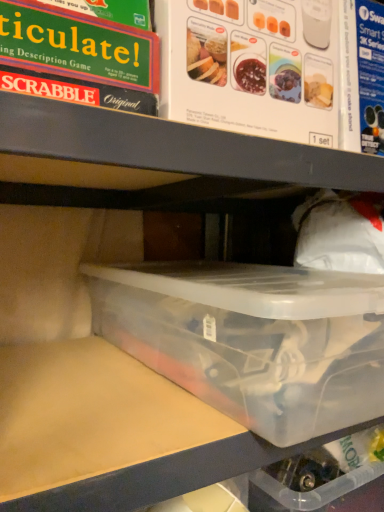
Question: Considering the positions of transparent plastic container at center and clear plastic container at center in the image, is transparent plastic container at center bigger or smaller than clear plastic container at center?

Choices:
 (A) big
 (B) small

Answer: (B)

Question: From their relative heights in the image, would you say transparent plastic container at center is taller or shorter than clear plastic container at center?

Choices:
 (A) short
 (B) tall

Answer: (A)

Question: From a real-world perspective, is transparent plastic container at center above or below clear plastic container at center?

Choices:
 (A) below
 (B) above

Answer: (A)

Question: Choose the correct answer: Is clear plastic container at center inside transparent plastic container at center or outside it?

Choices:
 (A) outside
 (B) inside

Answer: (A)

Question: In terms of width, does clear plastic container at center look wider or thinner when compared to transparent plastic container at center?

Choices:
 (A) thin
 (B) wide

Answer: (A)

Question: Is clear plastic container at center bigger or smaller than transparent plastic container at center?

Choices:
 (A) small
 (B) big

Answer: (B)

Question: From the image's perspective, relative to transparent plastic container at center, is clear plastic container at center above or below?

Choices:
 (A) below
 (B) above

Answer: (B)